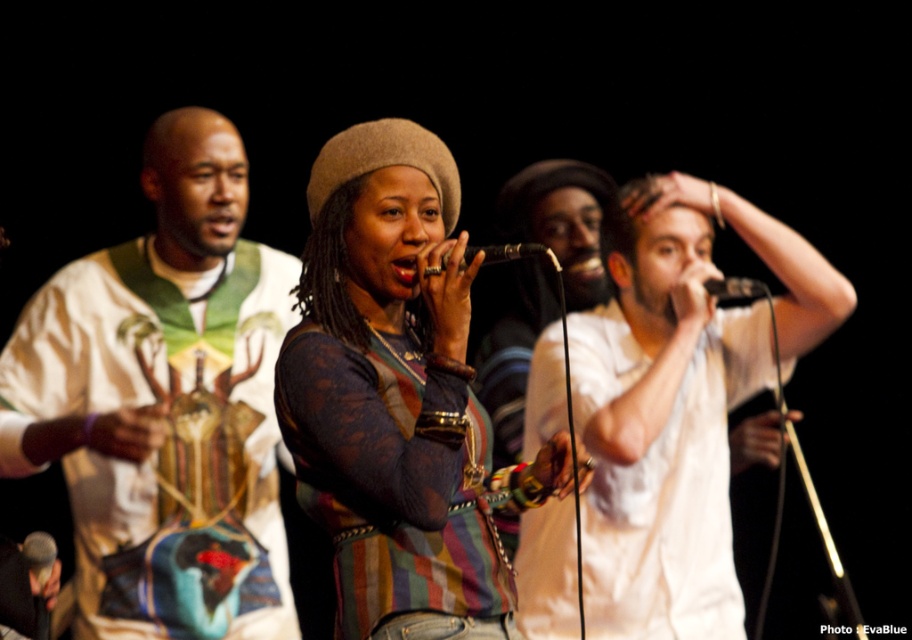
You are a photographer standing 2 meters away from the stage. You want to take a photo of the multicolored lace top at center and the white cotton shirt at center such that both are clearly visible in the frame. Given that your camera has a minimum focus distance of 1.5 meters, will you be able to capture both items clearly?

The photographer is standing 2 meters away from the stage, which is beyond the camera minimum focus distance of 1.5 meters. Therefore, both the multicolored lace top at center and the white cotton shirt at center will be in focus and clearly visible in the photo.

You are an audience member sitting in the front row of the stage. You see the metallic silver microphone at lower left and the black matte microphone at upper center. Which microphone is closer to you?

The metallic silver microphone at lower left is closer to you than the black matte microphone at upper center.